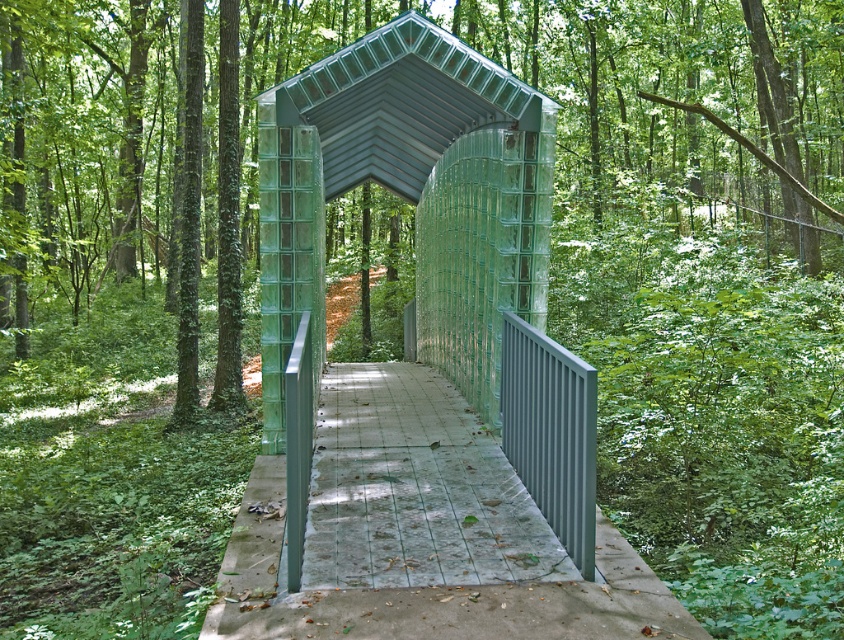
You are standing at the entrance of the forest walkway and want to reach the transparent glass gazebo at center. Which direction should you move relative to the smooth concrete path at center?

The transparent glass gazebo at center is closer to the viewer than the smooth concrete path at center, so you should move towards the gazebo by approaching it from the direction of the path.

You are a landscape architect designing a new pathway. You need to place a new bench along the transparent glass gazebo at center and the smooth concrete path at center. Which object has a narrower width to ensure the bench fits properly?

The transparent glass gazebo at center has a lesser width compared to the smooth concrete path at center, so the bench should be placed there to fit properly.